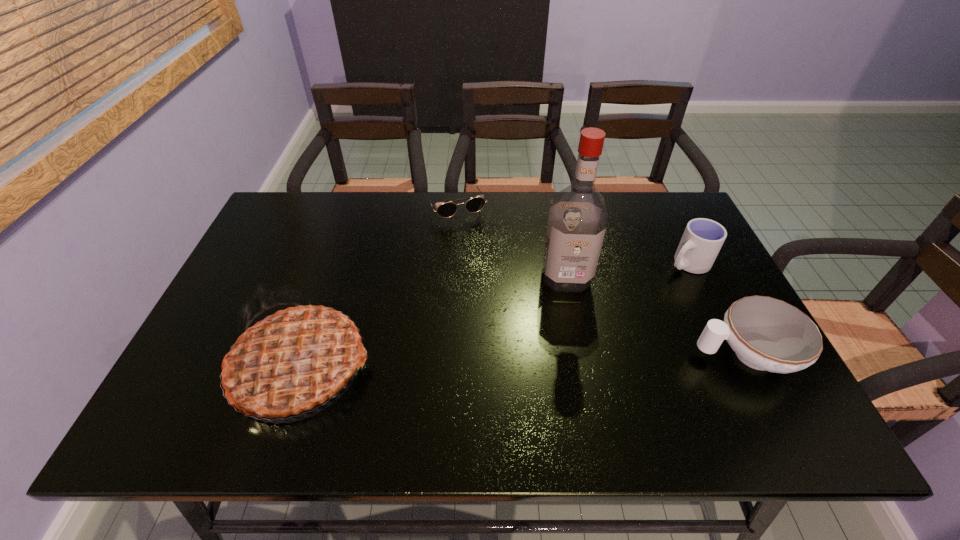
I want to click on free space on the desktop that is between the leftmost object and the chinaware and is positioned on the front-facing side of the third object from right to left, so click(576, 360).

Where is `vacant space on the desktop that is between the fourth shortest object and the chinaware and is positioned with the handle on the side of the cup`? The image size is (960, 540). vacant space on the desktop that is between the fourth shortest object and the chinaware and is positioned with the handle on the side of the cup is located at coordinates (506, 361).

In order to click on vacant spot on the desktop that is between the leftmost object and the chinaware and is positioned on the front lenses of the farthest object in this screenshot , I will do `click(527, 361)`.